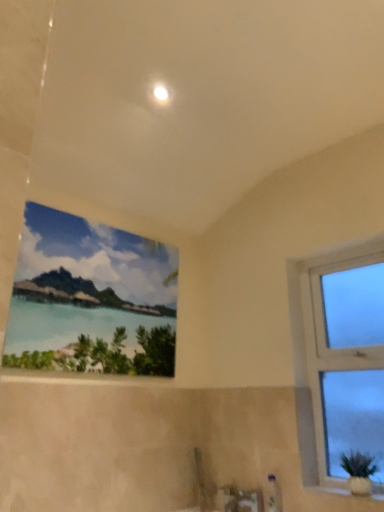
What is the approximate width of green matte plant at lower right?

It is 7.62 inches.

Locate an element on the screen. The image size is (384, 512). white glossy light at upper center is located at coordinates (160, 93).

Where is `the 1st window positioned below the white glossy light at upper center (from the image's perspective)`? The image size is (384, 512). the 1st window positioned below the white glossy light at upper center (from the image's perspective) is located at coordinates (89, 298).

In the image, is watercolor painting at upper center, the second window viewed from the right, positioned in front of or behind white glossy light at upper center?

In the image, watercolor painting at upper center, the second window viewed from the right, appears in front of white glossy light at upper center.

Measure the distance between watercolor painting at upper center, the second window viewed from the right, and white glossy light at upper center.

watercolor painting at upper center, the second window viewed from the right, and white glossy light at upper center are 3.58 feet apart from each other.

How many degrees apart are the facing directions of watercolor painting at upper center, the second window viewed from the right, and white glossy light at upper center?

The facing directions of watercolor painting at upper center, the second window viewed from the right, and white glossy light at upper center are 7.52e-05 degrees apart.

Is the position of white plastic window at right, placed as the 1th window when sorted from right to left, less distant than that of white glossy window sill at lower right?

No.

There is a white glossy window sill at lower right. Where is `the 1st window above it (from the image's perspective)`? The image size is (384, 512). the 1st window above it (from the image's perspective) is located at coordinates (345, 353).

Measure the distance from white plastic window at right, marked as the 2th window in a left-to-right arrangement, to white glossy window sill at lower right.

21.37 inches.

Is white plastic window at right, marked as the 2th window in a left-to-right arrangement, next to white glossy window sill at lower right?

white plastic window at right, marked as the 2th window in a left-to-right arrangement, and white glossy window sill at lower right are clearly separated.

Is green matte plant at lower right shorter than white plastic window at right, placed as the 1th window when sorted from right to left?

Yes, green matte plant at lower right is shorter than white plastic window at right, placed as the 1th window when sorted from right to left.

In terms of width, does green matte plant at lower right look wider or thinner when compared to white plastic window at right, marked as the 2th window in a left-to-right arrangement?

green matte plant at lower right is wider than white plastic window at right, marked as the 2th window in a left-to-right arrangement.

Looking at this image, from the image's perspective, relative to white plastic window at right, marked as the 2th window in a left-to-right arrangement, is green matte plant at lower right above or below?

green matte plant at lower right is below white plastic window at right, marked as the 2th window in a left-to-right arrangement.

Between white plastic window at right, placed as the 1th window when sorted from right to left, and green matte plant at lower right, which one appears on the right side from the viewer's perspective?

white plastic window at right, placed as the 1th window when sorted from right to left, is more to the right.

Can you tell me how much white plastic window at right, placed as the 1th window when sorted from right to left, and green matte plant at lower right differ in facing direction?

They differ by 0.000123 degrees in their facing directions.

Who is more distant, white plastic window at right, marked as the 2th window in a left-to-right arrangement, or green matte plant at lower right?

Positioned behind is white plastic window at right, marked as the 2th window in a left-to-right arrangement.

At what (x,y) coordinates should I click in order to perform the action: click on houseplant that appears below the white plastic window at right, marked as the 2th window in a left-to-right arrangement (from a real-world perspective). Please return your answer as a coordinate pair (x, y). The width and height of the screenshot is (384, 512). Looking at the image, I should click on (359, 472).

In the scene shown: Is watercolor painting at upper center, the 1th window in the left-to-right sequence, inside the boundaries of white plastic window at right, placed as the 1th window when sorted from right to left, or outside?

watercolor painting at upper center, the 1th window in the left-to-right sequence, lies outside white plastic window at right, placed as the 1th window when sorted from right to left.

Locate an element on the screen. Image resolution: width=384 pixels, height=512 pixels. window below the watercolor painting at upper center, the second window viewed from the right (from the image's perspective) is located at coordinates (345, 353).

Could you tell me if watercolor painting at upper center, the second window viewed from the right, is facing white plastic window at right, placed as the 1th window when sorted from right to left?

Yes, watercolor painting at upper center, the second window viewed from the right, faces towards white plastic window at right, placed as the 1th window when sorted from right to left.

Is point (172, 323) less distant than point (355, 379)?

No, (172, 323) is further to viewer.

Considering the relative sizes of white glossy window sill at lower right and white plastic window at right, marked as the 2th window in a left-to-right arrangement, in the image provided, is white glossy window sill at lower right thinner than white plastic window at right, marked as the 2th window in a left-to-right arrangement,?

No, white glossy window sill at lower right is not thinner than white plastic window at right, marked as the 2th window in a left-to-right arrangement.

In the scene shown: Which object is closer to the camera, white glossy window sill at lower right or white plastic window at right, placed as the 1th window when sorted from right to left?

white glossy window sill at lower right is in front.

Is white glossy window sill at lower right taller or shorter than green matte plant at lower right?

Considering their sizes, white glossy window sill at lower right has less height than green matte plant at lower right.

Considering the positions of objects white glossy window sill at lower right and green matte plant at lower right in the image provided, who is behind, white glossy window sill at lower right or green matte plant at lower right?

green matte plant at lower right.

In the image, is white glossy window sill at lower right on the left side or the right side of green matte plant at lower right?

Based on their positions, white glossy window sill at lower right is located to the left of green matte plant at lower right.

Is point (347, 482) positioned in front of point (364, 479)?

No, it is behind (364, 479).

Locate an element on the screen. This screenshot has height=512, width=384. light above the watercolor painting at upper center, the 1th window in the left-to-right sequence (from the image's perspective) is located at coordinates (160, 93).

I want to click on the 1st window located above the white glossy window sill at lower right (from a real-world perspective), so click(345, 353).

From the image, which object appears to be nearer to white plastic window at right, marked as the 2th window in a left-to-right arrangement, white glossy window sill at lower right or green matte plant at lower right?

green matte plant at lower right is closer to white plastic window at right, marked as the 2th window in a left-to-right arrangement.

Based on their spatial positions, is white glossy window sill at lower right or white glossy light at upper center closer to green matte plant at lower right?

white glossy window sill at lower right.

Estimate the real-world distances between objects in this image. Which object is further from green matte plant at lower right, watercolor painting at upper center, the second window viewed from the right, or white glossy light at upper center?

The object further to green matte plant at lower right is white glossy light at upper center.

Estimate the real-world distances between objects in this image. Which object is further from white plastic window at right, placed as the 1th window when sorted from right to left, green matte plant at lower right or white glossy light at upper center?

Among the two, white glossy light at upper center is located further to white plastic window at right, placed as the 1th window when sorted from right to left.

Considering their positions, is watercolor painting at upper center, the second window viewed from the right, positioned further to white plastic window at right, placed as the 1th window when sorted from right to left, than white glossy window sill at lower right?

Based on the image, watercolor painting at upper center, the second window viewed from the right, appears to be further to white plastic window at right, placed as the 1th window when sorted from right to left.

When comparing their distances from green matte plant at lower right, does white glossy light at upper center or white glossy window sill at lower right seem closer?

The object closer to green matte plant at lower right is white glossy window sill at lower right.

Looking at the image, which one is located closer to white glossy window sill at lower right, white glossy light at upper center or watercolor painting at upper center, the second window viewed from the right?

The object closer to white glossy window sill at lower right is watercolor painting at upper center, the second window viewed from the right.

Based on their spatial positions, is white glossy light at upper center or white glossy window sill at lower right closer to white plastic window at right, marked as the 2th window in a left-to-right arrangement?

white glossy window sill at lower right is closer to white plastic window at right, marked as the 2th window in a left-to-right arrangement.

Locate an element on the screen. This screenshot has height=512, width=384. light between watercolor painting at upper center, the 1th window in the left-to-right sequence, and white plastic window at right, placed as the 1th window when sorted from right to left is located at coordinates (160, 93).

Locate an element on the screen. This screenshot has width=384, height=512. houseplant between white plastic window at right, marked as the 2th window in a left-to-right arrangement, and white glossy window sill at lower right vertically is located at coordinates (359, 472).

Where is `window sill between watercolor painting at upper center, the second window viewed from the right, and green matte plant at lower right from left to right`? Image resolution: width=384 pixels, height=512 pixels. window sill between watercolor painting at upper center, the second window viewed from the right, and green matte plant at lower right from left to right is located at coordinates (353, 489).

This screenshot has height=512, width=384. What are the coordinates of `houseplant between watercolor painting at upper center, the second window viewed from the right, and white plastic window at right, placed as the 1th window when sorted from right to left, from left to right` in the screenshot? It's located at (359, 472).